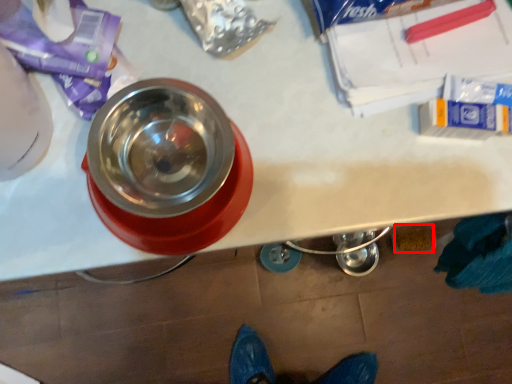
Question: Considering the relative positions of debris (annotated by the red box) and tableware in the image provided, where is debris (annotated by the red box) located with respect to the staircase?

Choices:
 (A) left
 (B) right

Answer: (B)